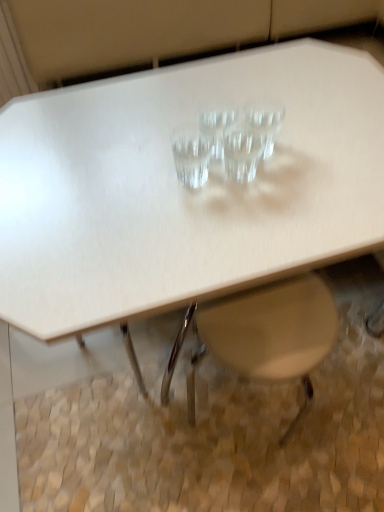
Find the location of a particular element. The image size is (384, 512). free point behind transparent glass martini at center, which is the 3th martini glass in left-to-right order is located at coordinates (239, 112).